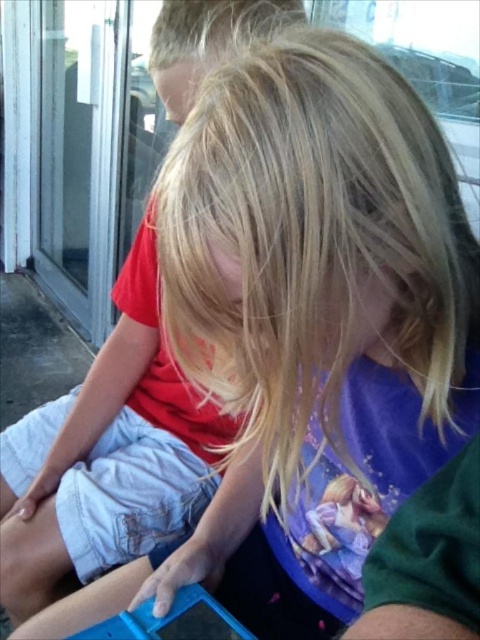
You are a parent trying to ensure your children are safe while playing. You see the transparent glass door at left and the blue plastic toy at lower center in the scene. Which object should you be more cautious about to prevent accidents?

The transparent glass door at left is much taller than the blue plastic toy at lower center, making it a higher risk for accidents as children might not see it and walk into it.

You are a delivery person who needs to enter the house through the transparent glass door at left. The GPS shows that the transparent glass door at left is located at point (81, 160). Can you estimate the direction to walk from your current position to reach the transparent glass door at left?

The transparent glass door at left is located at point (81, 160), so you should walk towards the left side of the frame to reach it.